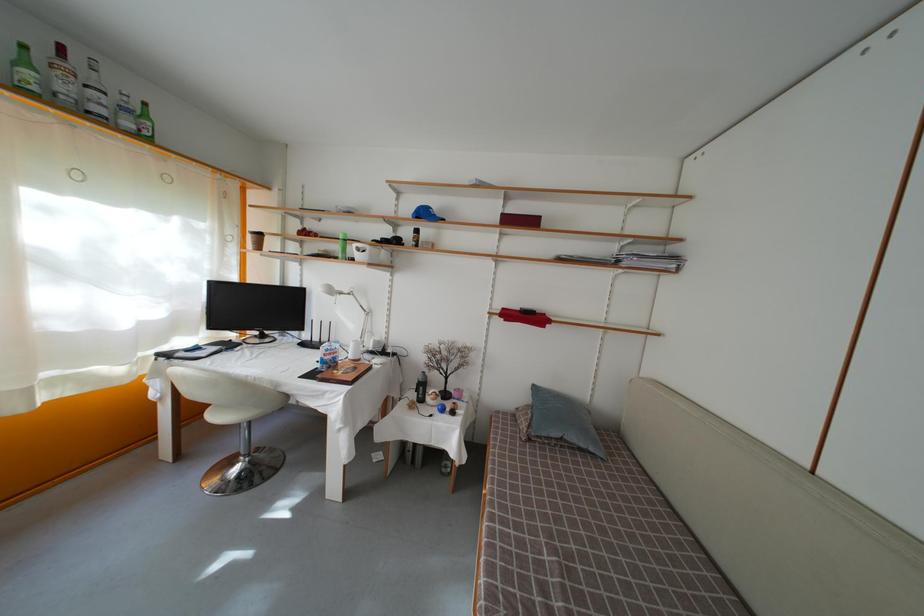
I want to click on red rectangular box, so click(519, 220).